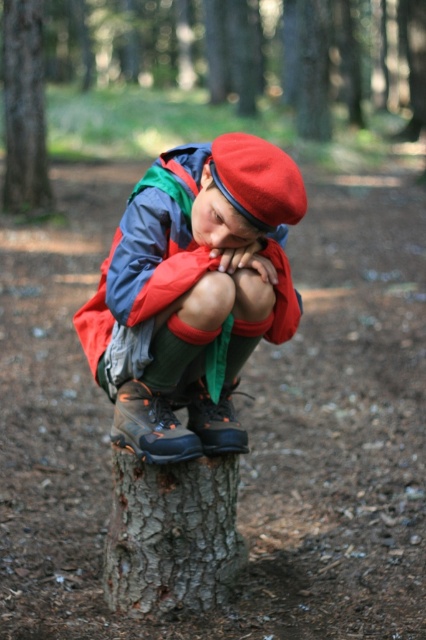
You are a photographer trying to capture a closeup of the red felt beret at center and the brown rough tree stump at center. Since you want to focus on the beret, which object should you move closer to the camera to ensure it appears larger in the photo?

To make the red felt beret at center appear larger in the photo, you should move it closer to the camera. The brown rough tree stump at center is wider than the red felt beret at center, so moving the beret forward will help it dominate the frame.

You are a forest ranger assessing the safety of the area for children. The brown rough tree stump at center and the gray rough bark tree trunk at center are both in the path. Which one has a wider base that could pose a tripping hazard?

The brown rough tree stump at center has a wider base than the gray rough bark tree trunk at center, making it a larger tripping hazard.

You are a photographer trying to capture the gray rough bark tree trunk at center and the red felt beret at center in a single frame. Based on their positions, which object should you adjust your camera to focus on first to ensure both are in the frame?

Since the gray rough bark tree trunk at center is to the left of the red felt beret at center, you should focus on the gray rough bark tree trunk at center first as it is positioned further left, ensuring both objects remain within the frame.